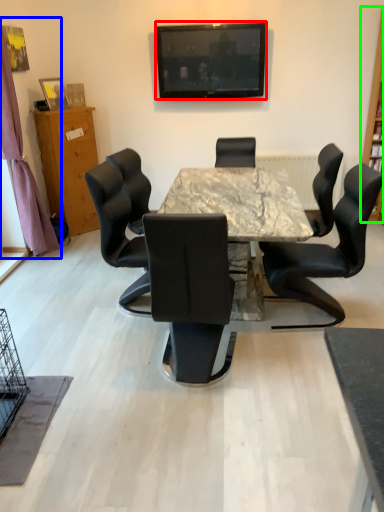
Question: Which object is positioned farthest from television (highlighted by a red box)? Select from curtain (highlighted by a blue box) and bookshelf (highlighted by a green box).

Choices:
 (A) curtain
 (B) bookshelf

Answer: (A)